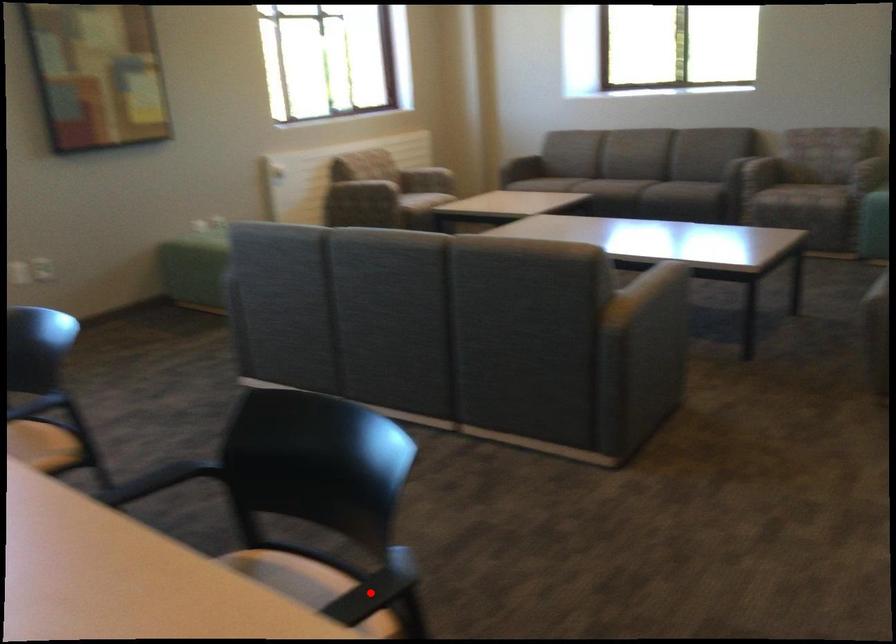
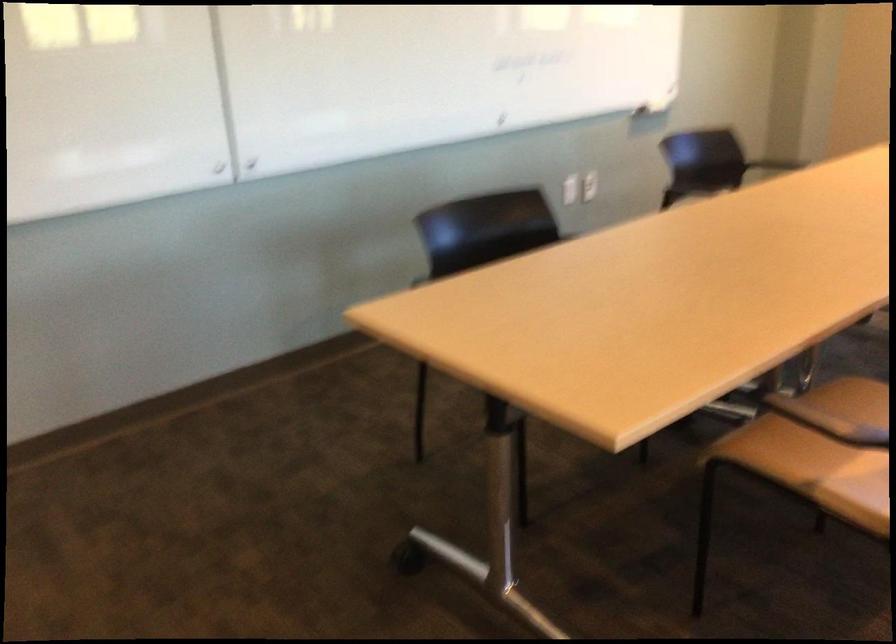
Question: I am providing you with two images of the same scene from different viewpoints. A red point is marked on the first image. Can you still see the location of the red point in image 2?

Choices:
 (A) Yes
 (B) No

Answer: (B)